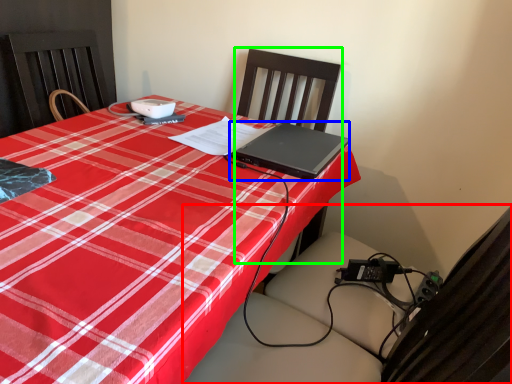
Question: Which is farther away from swivel chair (highlighted by a red box)? laptop (highlighted by a blue box) or chair (highlighted by a green box)?

Choices:
 (A) laptop
 (B) chair

Answer: (B)